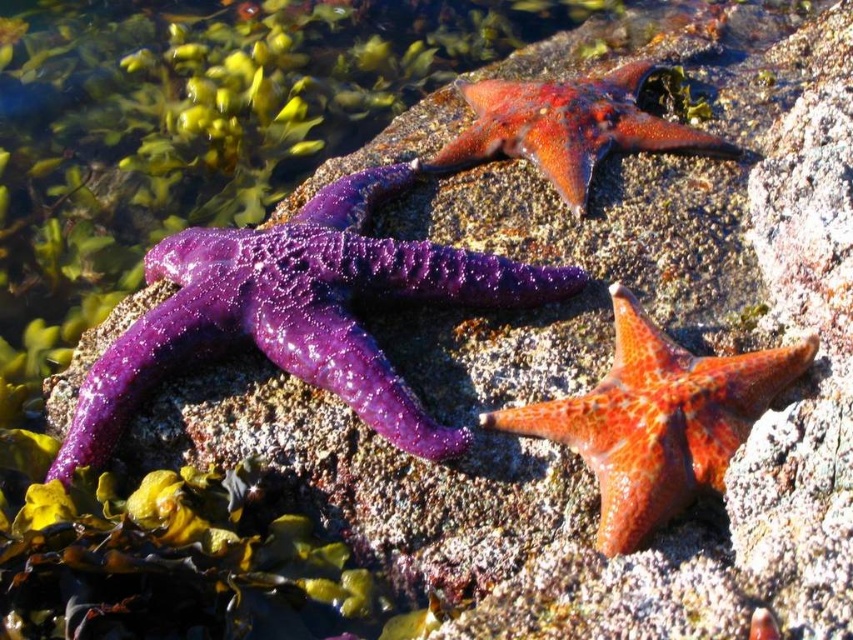
You are a marine biologist studying starfish in a tide pool. You observe two points marked on a map of the area. The first point is at coordinates point (329, 317), and the second is at point (663, 140). Based on your knowledge of the terrain, which point is closer to the observer standing at the edge of the tide pool?

Point (329, 317) is in front of point (663, 140), so it is closer to the observer standing at the edge of the tide pool.

You are a marine biologist examining the starfish in the image. You need to collect the purple wet starfish at left and the shiny orange starfish at upper center. Which one should you reach for first to ensure you can easily access both without moving the other?

You should reach for the purple wet starfish at left first because it is closer to you than the shiny orange starfish at upper center, allowing you to access both without disturbing the other.